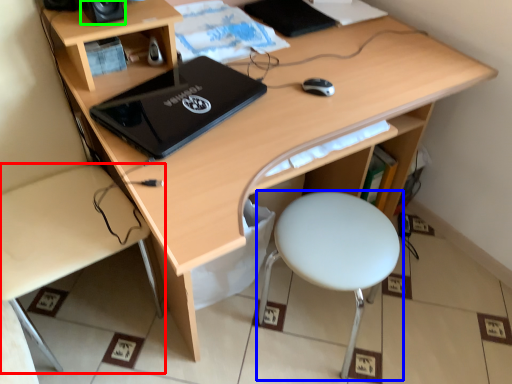
Question: Which is nearer to the desk (highlighted by a red box)? stool (highlighted by a blue box) or speaker (highlighted by a green box).

Choices:
 (A) stool
 (B) speaker

Answer: (B)